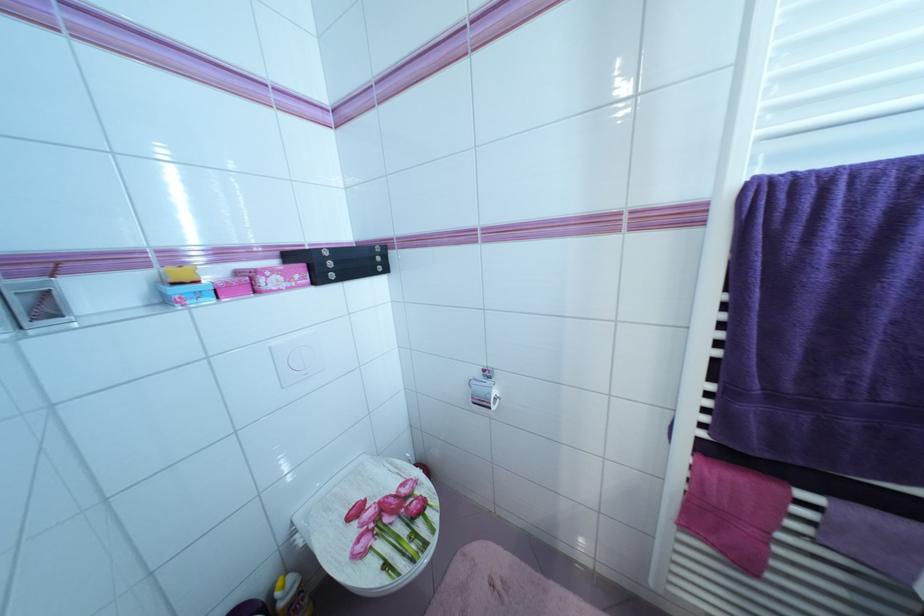
Find where to lift the floral toilet lid. Please return your answer as a coordinate pair (x, y).

(396, 541)